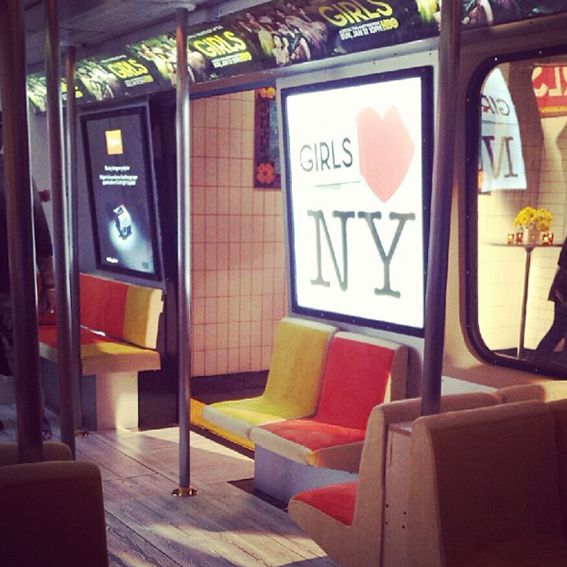
At what (x,y) coordinates should I click in order to perform the action: click on waiting area. Please return your answer as a coordinate pair (x, y). Image resolution: width=567 pixels, height=567 pixels. Looking at the image, I should click on (224, 296).